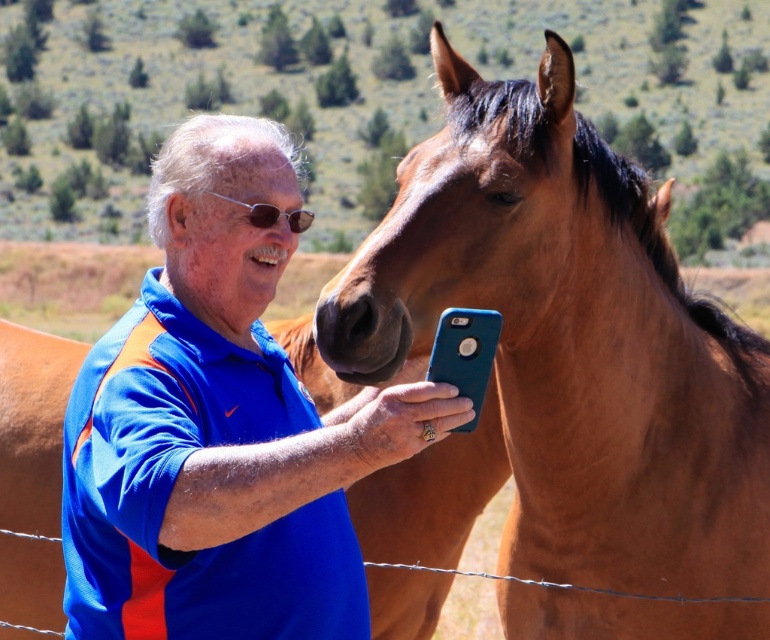
Question: Is blue fabric shirt at center closer to camera compared to sunglasses at center?

Choices:
 (A) yes
 (B) no

Answer: (A)

Question: Which point is closer to the camera?

Choices:
 (A) (216, 195)
 (B) (467, 291)
 (C) (166, 609)

Answer: (C)

Question: Does brown matte horse at center appear on the right side of sunglasses at center?

Choices:
 (A) no
 (B) yes

Answer: (B)

Question: Does blue fabric shirt at center have a larger size compared to sunglasses at center?

Choices:
 (A) yes
 (B) no

Answer: (A)

Question: Which object is the closest to the brown matte horse at center?

Choices:
 (A) sunglasses at center
 (B) blue fabric shirt at center

Answer: (B)

Question: Considering the real-world distances, which object is farthest from the blue fabric shirt at center?

Choices:
 (A) brown matte horse at center
 (B) sunglasses at center

Answer: (A)